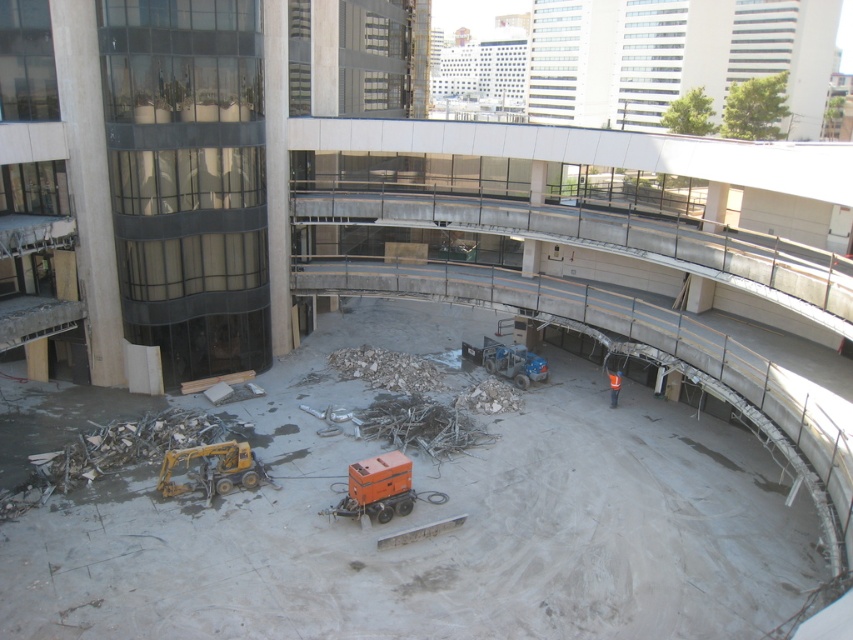
Is orange rubbermaid container at center smaller than yellow metallic excavator at lower left?

No, orange rubbermaid container at center is not smaller than yellow metallic excavator at lower left.

Looking at this image, does orange rubbermaid container at center have a greater height compared to yellow metallic excavator at lower left?

Indeed, orange rubbermaid container at center has a greater height compared to yellow metallic excavator at lower left.

What do you see at coordinates (376, 488) in the screenshot? I see `orange rubbermaid container at center` at bounding box center [376, 488].

Find the location of `orange rubbermaid container at center`. orange rubbermaid container at center is located at coordinates (376, 488).

From the picture: Is concrete debris at center smaller than yellow metallic excavator at lower left?

No, concrete debris at center is not smaller than yellow metallic excavator at lower left.

Describe the element at coordinates (432, 520) in the screenshot. I see `concrete debris at center` at that location.

Between point (157, 616) and point (207, 490), which one is positioned behind?

The point (207, 490) is more distant.

Locate an element on the screen. Image resolution: width=853 pixels, height=640 pixels. concrete debris at center is located at coordinates (432, 520).

Which is more to the right, concrete debris at center or orange reflective vest at center?

From the viewer's perspective, orange reflective vest at center appears more on the right side.

Where is `concrete debris at center`? The image size is (853, 640). concrete debris at center is located at coordinates (432, 520).